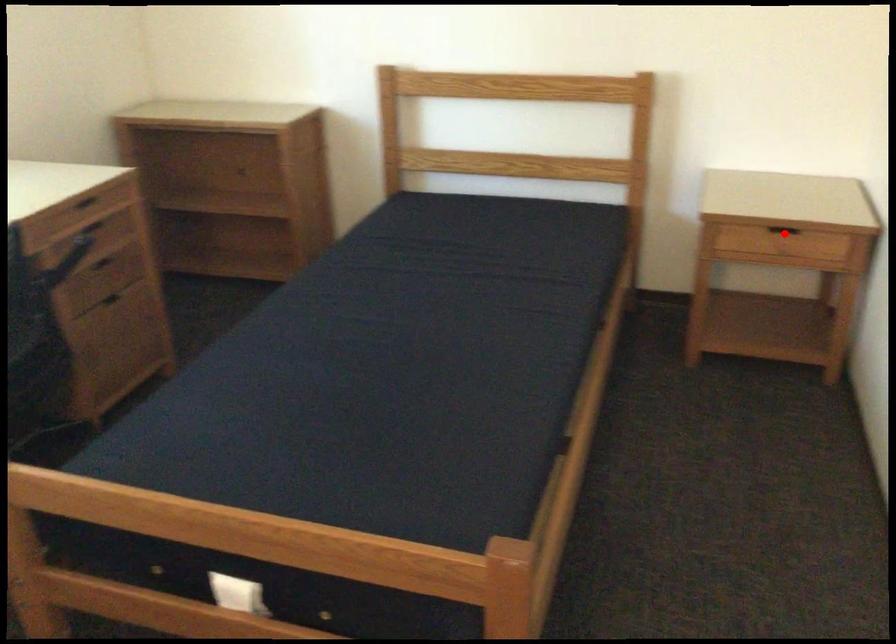
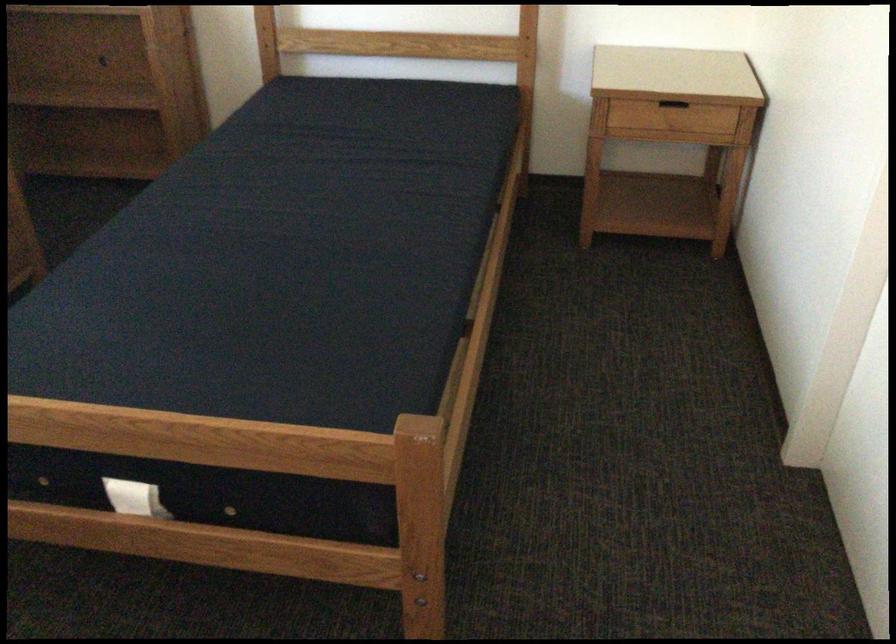
In the second image, find the point that corresponds to the highlighted location in the first image.

(673, 109)